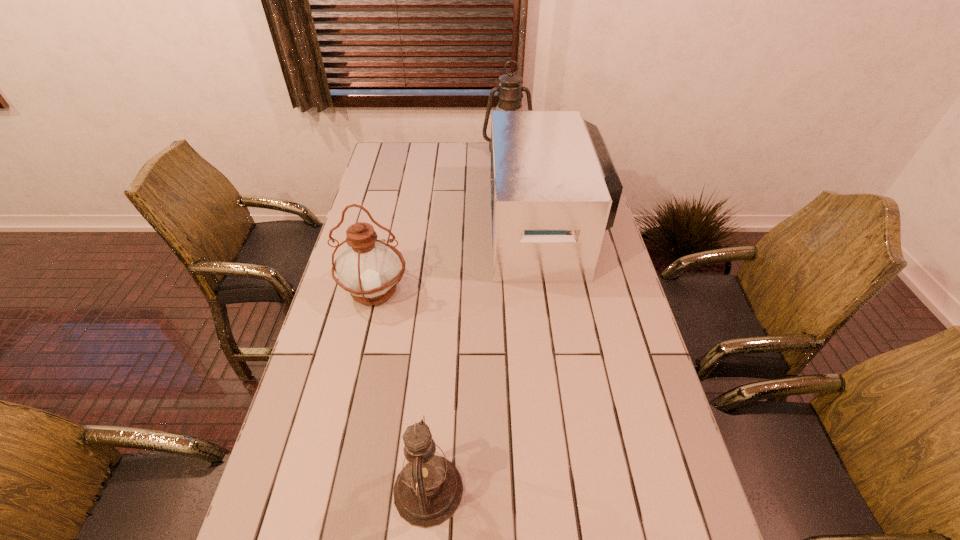
At what (x,y) coordinates should I click in order to perform the action: click on unoccupied area between the farthest oil lamp and the nearest oil lamp. Please return your answer as a coordinate pair (x, y). This screenshot has height=540, width=960. Looking at the image, I should click on (468, 320).

You are a GUI agent. You are given a task and a screenshot of the screen. Output one action in this format:
    pyautogui.click(x=<x>, y=<y>)
    Task: Click on the empty location between the microwave oven and the third object from right to left
    The height and width of the screenshot is (540, 960).
    Given the screenshot: What is the action you would take?
    pyautogui.click(x=488, y=359)

I want to click on vacant point located between the microwave oven and the second nearest oil lamp, so click(x=461, y=259).

Where is `vacant space that is in between the second nearest oil lamp and the microwave oven`? The width and height of the screenshot is (960, 540). vacant space that is in between the second nearest oil lamp and the microwave oven is located at coordinates (461, 259).

Locate which object is the closest to the nearest object. Please provide its 2D coordinates. Your answer should be formatted as a tuple, i.e. [(x, y)], where the tuple contains the x and y coordinates of a point satisfying the conditions above.

[(368, 268)]

Locate an element on the screen. The width and height of the screenshot is (960, 540). object that stands as the second closest to the leftmost oil lamp is located at coordinates (428, 490).

Point out which oil lamp is positioned as the second nearest to the tallest oil lamp. Please provide its 2D coordinates. Your answer should be formatted as a tuple, i.e. [(x, y)], where the tuple contains the x and y coordinates of a point satisfying the conditions above.

[(428, 490)]

The height and width of the screenshot is (540, 960). What are the coordinates of `oil lamp that is the second closest to the leftmost oil lamp` in the screenshot? It's located at point(510,89).

Identify the location of vacant region that satisfies the following two spatial constraints: 1. on the back side of the tallest object; 2. on the right side of the leftmost object. The width and height of the screenshot is (960, 540). (407, 151).

Locate an element on the screen. This screenshot has height=540, width=960. vacant region that satisfies the following two spatial constraints: 1. on the front side of the second object from left to right; 2. on the right side of the leftmost oil lamp is located at coordinates (329, 490).